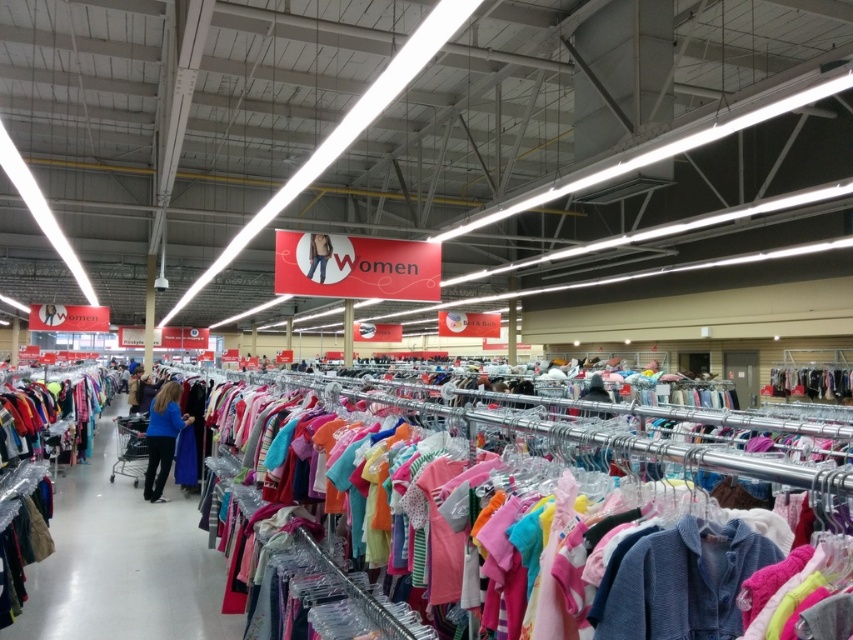
From the picture: Can you confirm if matte plastic hangers at center is positioned below blue cotton shirt at center?

Actually, matte plastic hangers at center is above blue cotton shirt at center.

The image size is (853, 640). Describe the element at coordinates (531, 509) in the screenshot. I see `matte plastic hangers at center` at that location.

Does point (225, 385) lie in front of point (173, 381)?

Yes, point (225, 385) is closer to viewer.

Image resolution: width=853 pixels, height=640 pixels. I want to click on matte plastic hangers at center, so click(531, 509).

Where is `matte blue dress at center`? matte blue dress at center is located at coordinates (123, 563).

Describe the element at coordinates (123, 563) in the screenshot. This screenshot has height=640, width=853. I see `matte blue dress at center` at that location.

This screenshot has height=640, width=853. What do you see at coordinates (123, 563) in the screenshot?
I see `matte blue dress at center` at bounding box center [123, 563].

Identify the location of matte blue dress at center. This screenshot has width=853, height=640. (123, 563).

Between matte plastic hangers at center and matte blue dress at center, which one appears on the left side from the viewer's perspective?

matte blue dress at center is more to the left.

Is matte plastic hangers at center wider than matte blue dress at center?

No, matte plastic hangers at center is not wider than matte blue dress at center.

Does point (677, 460) come closer to viewer compared to point (125, 493)?

That is True.

This screenshot has width=853, height=640. In order to click on matte plastic hangers at center in this screenshot , I will do `click(531, 509)`.